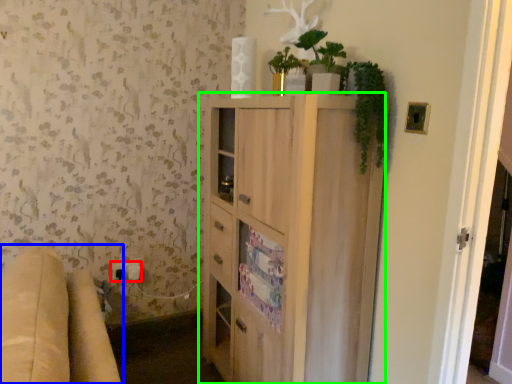
Question: Considering the real-world distances, which object is closest to electric outlet (highlighted by a red box)? studio couch (highlighted by a blue box) or cabinetry (highlighted by a green box).

Choices:
 (A) studio couch
 (B) cabinetry

Answer: (B)